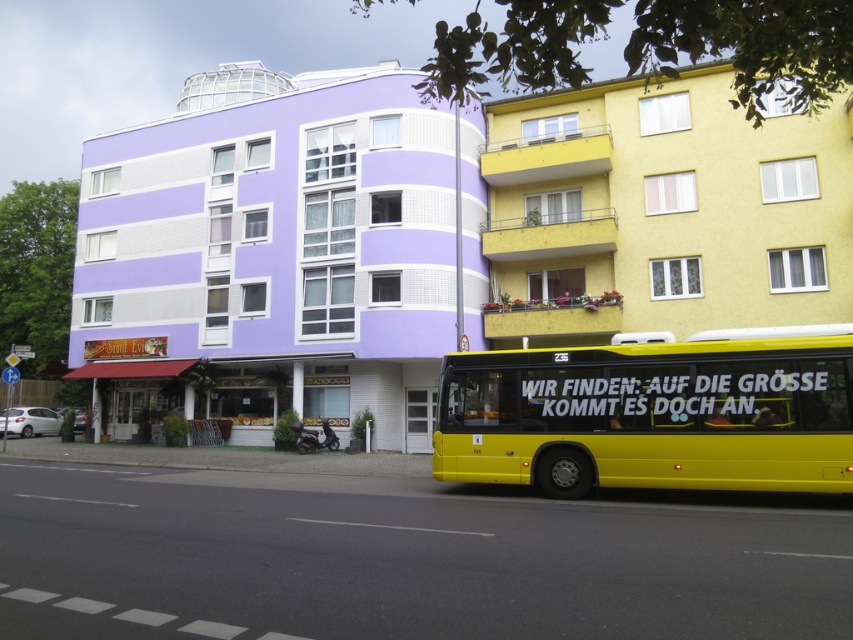
Question: Considering the relative positions of purple matte building at center and yellow textured building at upper right in the image provided, where is purple matte building at center located with respect to yellow textured building at upper right?

Choices:
 (A) left
 (B) right

Answer: (A)

Question: Which object is closer to the camera taking this photo?

Choices:
 (A) yellow textured building at upper right
 (B) yellow metallic bus at lower right
 (C) purple matte building at center

Answer: (B)

Question: Does yellow textured building at upper right appear on the right side of yellow metallic bus at lower right?

Choices:
 (A) no
 (B) yes

Answer: (B)

Question: Is purple matte building at center in front of yellow metallic bus at lower right?

Choices:
 (A) no
 (B) yes

Answer: (A)

Question: Which point appears farthest from the camera in this image?

Choices:
 (A) (247, 212)
 (B) (842, 211)
 (C) (730, 336)

Answer: (A)

Question: Which object is the farthest from the yellow textured building at upper right?

Choices:
 (A) purple matte building at center
 (B) yellow metallic bus at lower right

Answer: (B)